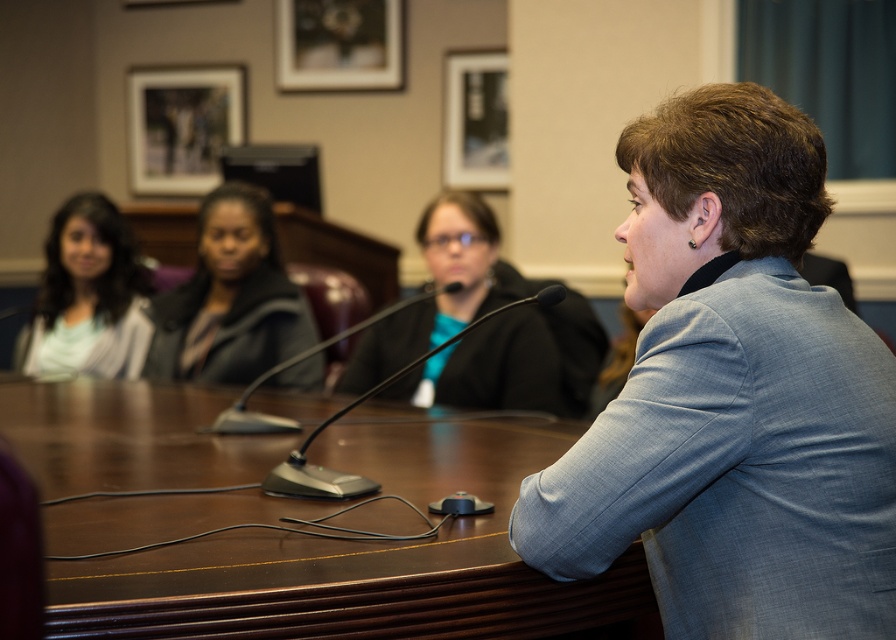
Question: Which of the following is the closest to the observer?

Choices:
 (A) (643, 566)
 (B) (701, 125)
 (C) (432, 230)
 (D) (112, 317)

Answer: (B)

Question: Which object is closer to the camera taking this photo?

Choices:
 (A) blue fabric jacket at center
 (B) light blue shirt at left
 (C) brown wood table at center

Answer: (C)

Question: Is blue textured blazer at center positioned in front of brown wood table at center?

Choices:
 (A) no
 (B) yes

Answer: (A)

Question: Which point is closer to the camera?

Choices:
 (A) blue fabric jacket at center
 (B) blue textured blazer at center
 (C) matte black jacket at center

Answer: (B)

Question: Does blue fabric jacket at center have a larger size compared to light blue shirt at left?

Choices:
 (A) yes
 (B) no

Answer: (A)

Question: Observing the image, what is the correct spatial positioning of blue textured blazer at center in reference to blue fabric jacket at center?

Choices:
 (A) left
 (B) right

Answer: (B)